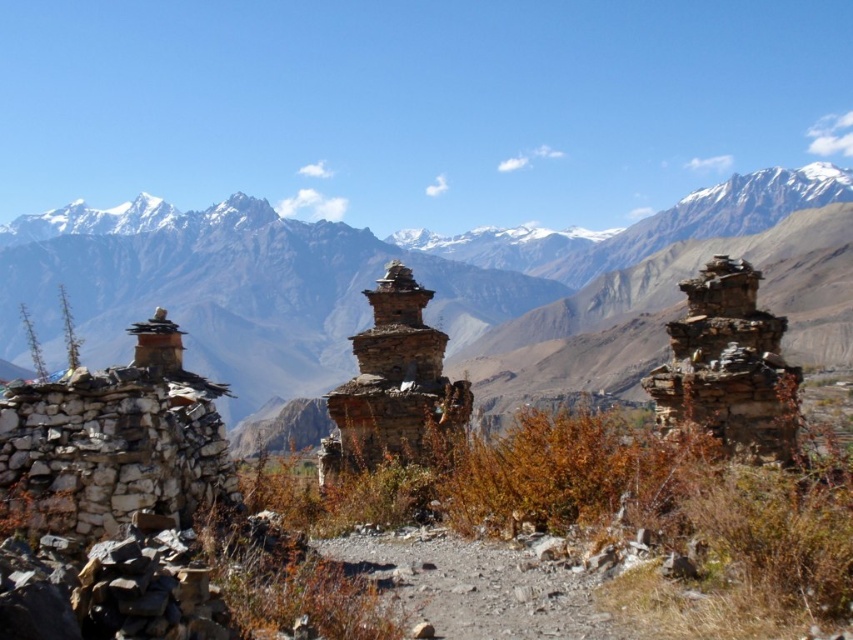
Question: Which point is farther to the camera?

Choices:
 (A) rugged stone mountain range at center
 (B) rustic stone stupa at right

Answer: (A)

Question: Is rugged stone mountain range at center thinner than brown stone stupa at center?

Choices:
 (A) yes
 (B) no

Answer: (B)

Question: Is rugged stone mountain range at center above brown stone stupa at center?

Choices:
 (A) no
 (B) yes

Answer: (B)

Question: Which of these objects is positioned closest to the brown stone stupa at center?

Choices:
 (A) rustic stone stupa at right
 (B) rugged stone mountain range at center

Answer: (A)

Question: Which point is closer to the camera?

Choices:
 (A) (384, 429)
 (B) (682, 372)

Answer: (B)

Question: Does rugged stone mountain range at center lie in front of brown stone stupa at center?

Choices:
 (A) no
 (B) yes

Answer: (A)